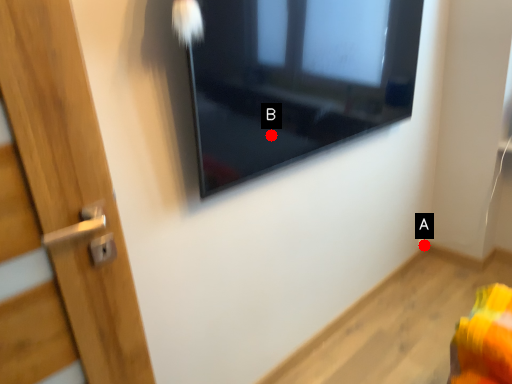
Question: Two points are circled on the image, labeled by A and B beside each circle. Which point appears farthest from the camera in this image?

Choices:
 (A) A is further
 (B) B is further

Answer: (A)